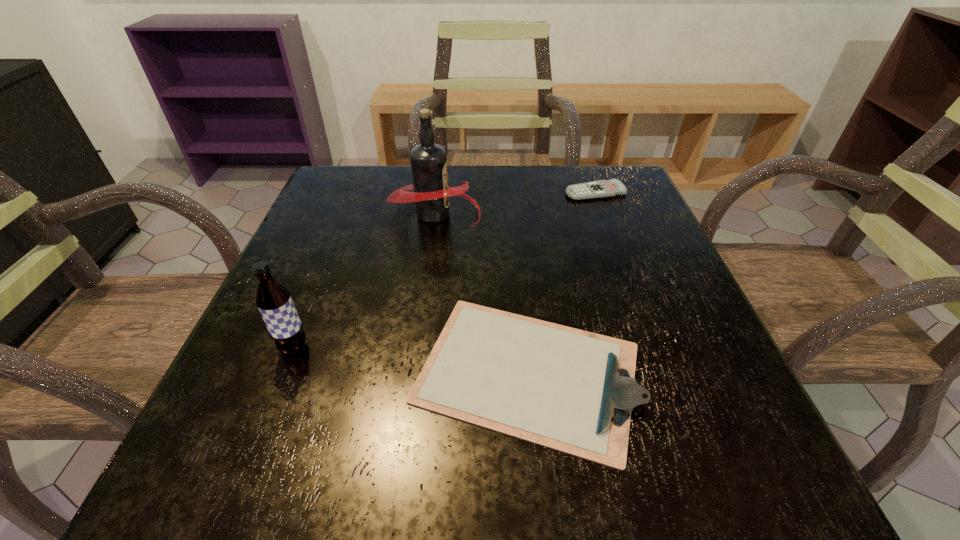
You are a GUI agent. You are given a task and a screenshot of the screen. Output one action in this format:
    pyautogui.click(x=<x>, y=<y>)
    Task: Click on the free point that satisfies the following two spatial constraints: 1. on the label of the tallest object; 2. on the back side of the third tallest object
    
    Given the screenshot: What is the action you would take?
    pyautogui.click(x=413, y=373)